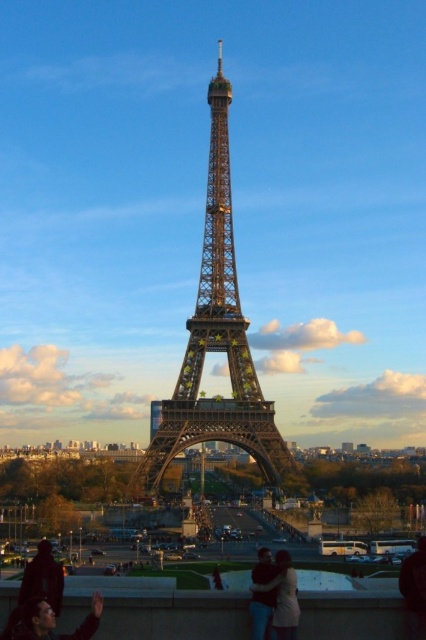
You are standing at the base of the Eiffel Tower and notice two people in the foreground. One has matte black hair at lower left and the other is wearing a light brown leather jacket at lower center. Which person is closer to the staircase leading up to the Eiffel Tower entrance?

The matte black hair at lower left is located below the light brown leather jacket at lower center, meaning the person with matte black hair at lower left is closer to the staircase leading up to the Eiffel Tower entrance.

You are standing at the camera position and want to walk to point (94, 611). Is the distance less than 1000 feet?

The distance between point (94, 611) and the camera is 547.12 feet, which is less than 1000 feet.

You are planning to take a photo of the metallic structure at center and the light brown leather jacket at lower center in the scene. Which object should you focus on first if you want to capture both in a single frame without moving the camera?

You should focus on the metallic structure at center first because it is much taller than the light brown leather jacket at lower center, so it will occupy more space in the frame and ensure proper composition.